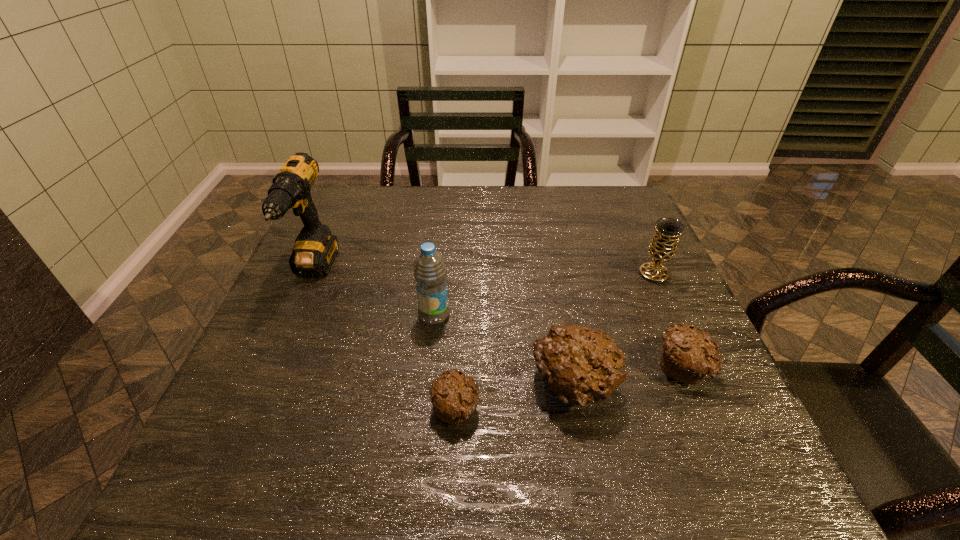
The muffins are evenly distributed in the image. To maintain this, where would you place another muffin on the left? Please point to a free space. Please provide its 2D coordinates. Your answer should be formatted as a tuple, i.e. [(x, y)], where the tuple contains the x and y coordinates of a point satisfying the conditions above.

[(326, 430)]